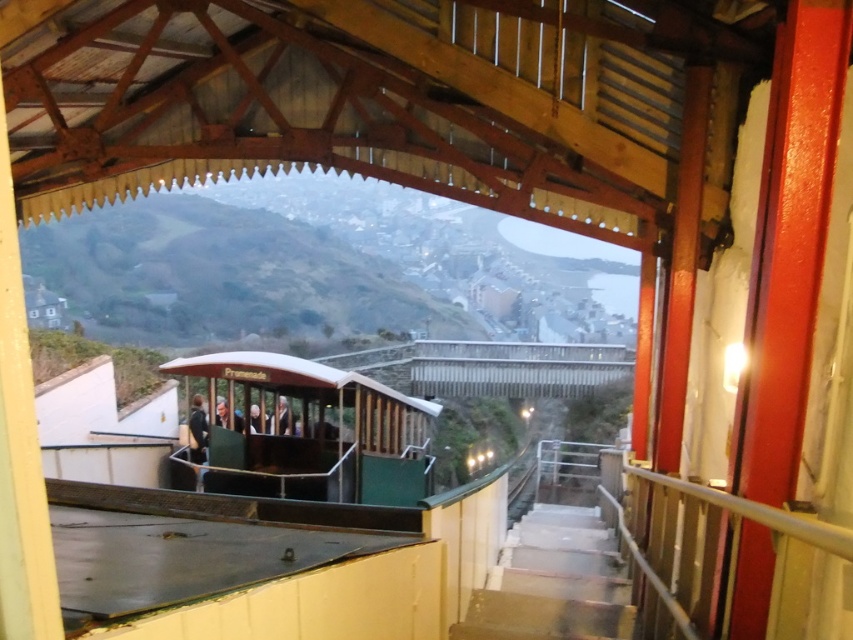
Is smooth beige coat at center in front of smooth skin face at center?

No, it is not.

Which is behind, point (292, 429) or point (219, 403)?

Positioned behind is point (292, 429).

Locate an element on the screen. smooth beige coat at center is located at coordinates (281, 419).

Who is more forward, (547, 600) or (195, 452)?

Point (547, 600) is in front.

Does white concrete stairs at lower right have a larger size compared to dark brown leather jacket at center?

Correct, white concrete stairs at lower right is larger in size than dark brown leather jacket at center.

Image resolution: width=853 pixels, height=640 pixels. I want to click on white concrete stairs at lower right, so coord(553,580).

Identify the location of white concrete stairs at lower right. Image resolution: width=853 pixels, height=640 pixels. (553, 580).

Does dark brown leather jacket at center lie in front of smooth beige coat at center?

Yes, it is.

Does dark brown leather jacket at center appear on the right side of smooth beige coat at center?

No, dark brown leather jacket at center is not to the right of smooth beige coat at center.

I want to click on dark brown leather jacket at center, so click(196, 429).

Locate an element on the screen. This screenshot has height=640, width=853. dark brown leather jacket at center is located at coordinates (196, 429).